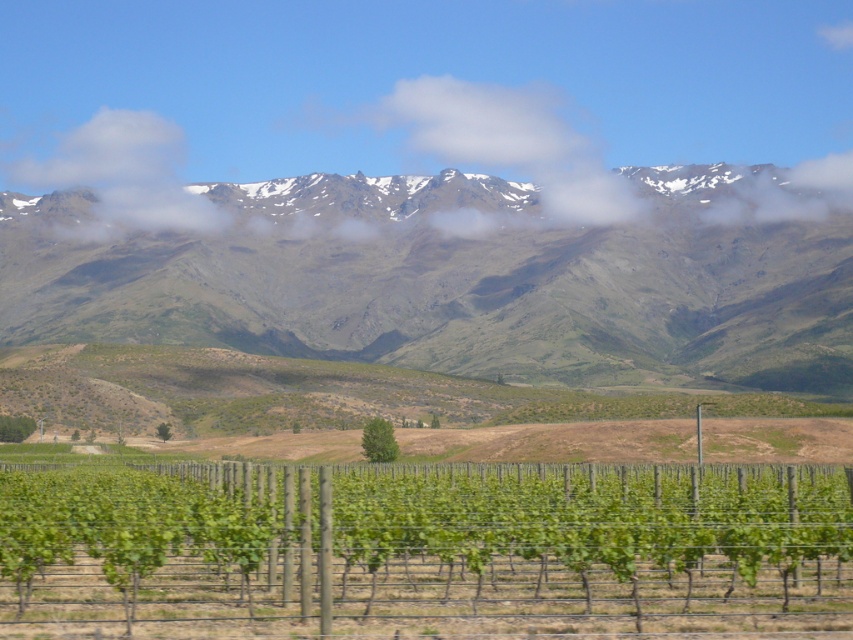
Question: In this image, where is green grassy mountain range at upper center located relative to snowy mountain range at upper center?

Choices:
 (A) left
 (B) right

Answer: (B)

Question: Which is farther from the green leafy vine at center?

Choices:
 (A) snowy mountain range at upper center
 (B) green grassy mountain range at upper center

Answer: (A)

Question: Which point is farther from the camera taking this photo?

Choices:
 (A) (144, 536)
 (B) (213, 132)
 (C) (670, 305)

Answer: (B)

Question: Which object is positioned closest to the snowy mountain range at upper center?

Choices:
 (A) green grassy mountain range at upper center
 (B) green leafy vine at center

Answer: (A)

Question: Does green leafy vine at center appear on the right side of snowy mountain range at upper center?

Choices:
 (A) no
 (B) yes

Answer: (B)

Question: Does green leafy vine at center have a lesser width compared to snowy mountain range at upper center?

Choices:
 (A) yes
 (B) no

Answer: (A)